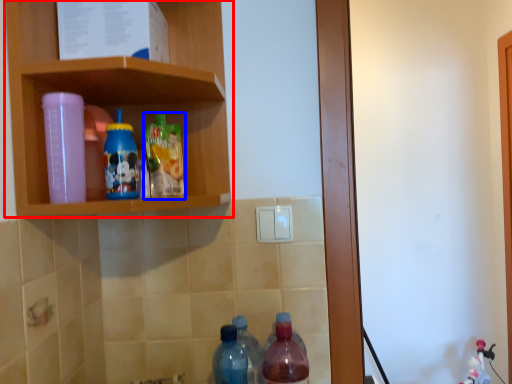
Question: Which object is closer to the camera taking this photo, shelf (highlighted by a red box) or bottle (highlighted by a blue box)?

Choices:
 (A) shelf
 (B) bottle

Answer: (A)